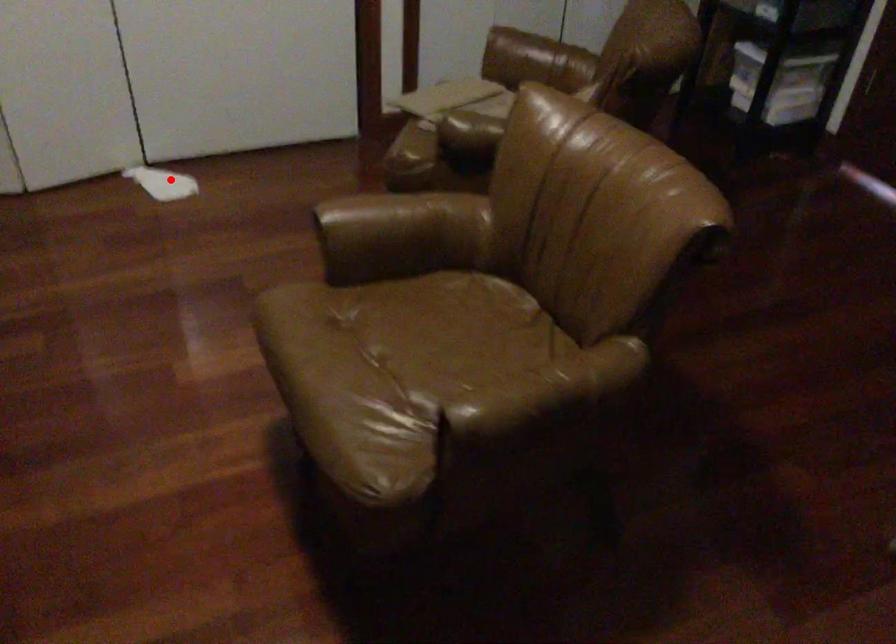
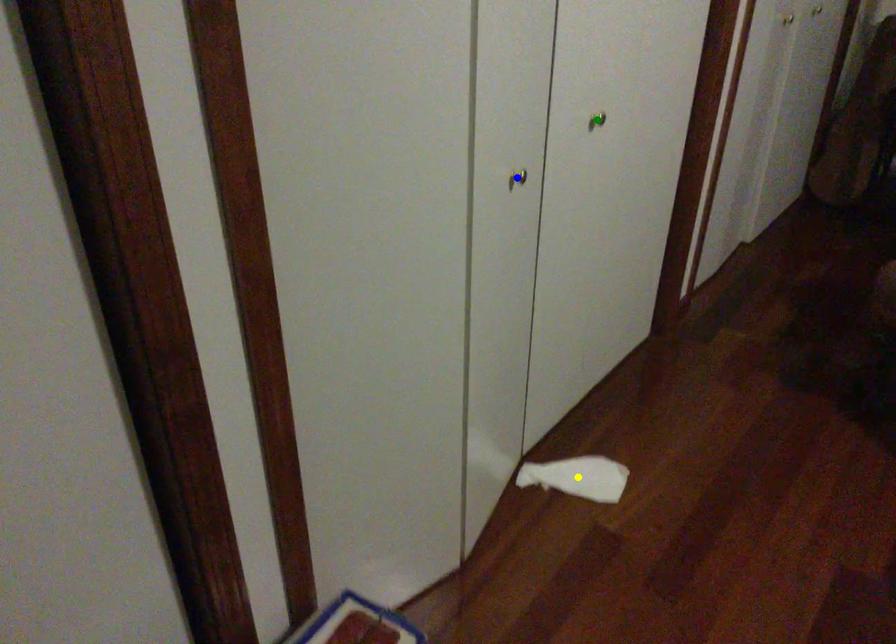
Question: I am providing you with two images of the same scene from different viewpoints. A red point is marked on the first image. You are given multiple points on the second image. Which mark in image 2 goes with the point in image 1?

Choices:
 (A) blue point
 (B) green point
 (C) yellow point

Answer: (C)